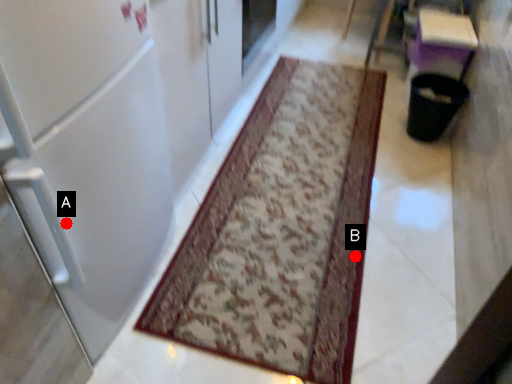
Question: Two points are circled on the image, labeled by A and B beside each circle. Which point is further to the camera?

Choices:
 (A) A is further
 (B) B is further

Answer: (B)